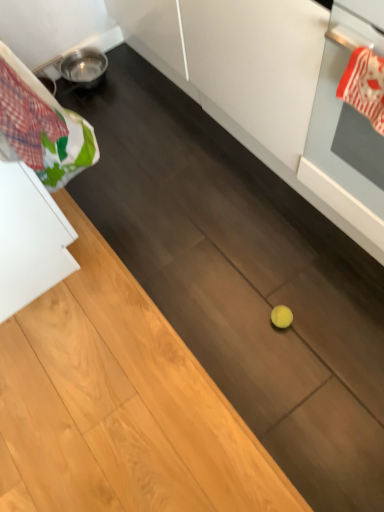
Question: Is red and white striped oven mitt at upper right wider or thinner than plaid fabric laundry at upper left?

Choices:
 (A) thin
 (B) wide

Answer: (A)

Question: Is point (372, 72) closer or farther from the camera than point (56, 138)?

Choices:
 (A) closer
 (B) farther

Answer: (A)

Question: Estimate the real-world distances between objects in this image. Which object is closer to the red and white striped oven mitt at upper right?

Choices:
 (A) white glossy oven at right
 (B) plaid fabric laundry at upper left

Answer: (A)

Question: Which object is the closest to the white glossy oven at right?

Choices:
 (A) plaid fabric laundry at upper left
 (B) red and white striped oven mitt at upper right

Answer: (B)